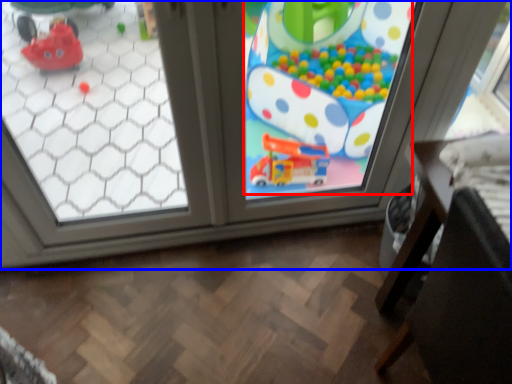
Question: Which point is closer to the camera, toy (highlighted by a red box) or window (highlighted by a blue box)?

Choices:
 (A) toy
 (B) window

Answer: (B)